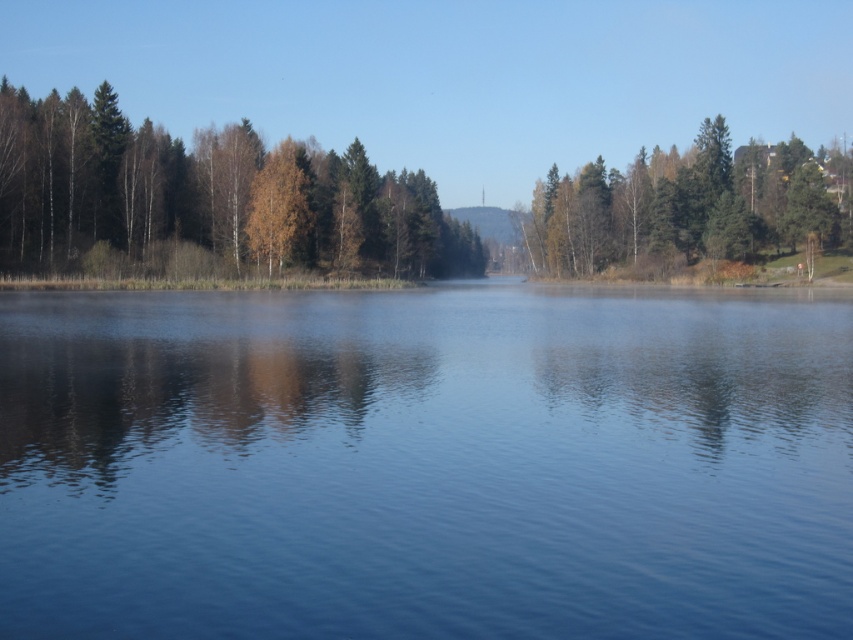
Question: Does brown textured trees at left appear on the left side of green matte tree at upper right?

Choices:
 (A) yes
 (B) no

Answer: (A)

Question: Is transparent water at center above brown textured trees at left?

Choices:
 (A) yes
 (B) no

Answer: (B)

Question: Which object is closer to the camera taking this photo?

Choices:
 (A) brown textured trees at left
 (B) transparent water at center

Answer: (B)

Question: Observing the image, what is the correct spatial positioning of transparent water at center in reference to brown textured trees at left?

Choices:
 (A) right
 (B) left

Answer: (A)

Question: Estimate the real-world distances between objects in this image. Which object is farther from the green matte tree at upper right?

Choices:
 (A) transparent water at center
 (B) brown textured trees at left

Answer: (A)

Question: Which point appears closest to the camera in this image?

Choices:
 (A) (735, 177)
 (B) (421, 547)

Answer: (B)